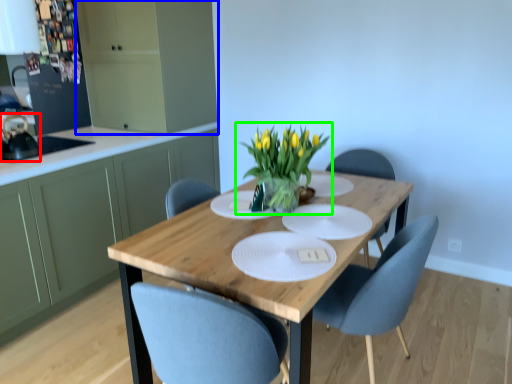
Question: Which object is positioned farthest from appliance (highlighted by a red box)? Select from cabinetry (highlighted by a blue box) and houseplant (highlighted by a green box).

Choices:
 (A) cabinetry
 (B) houseplant

Answer: (B)